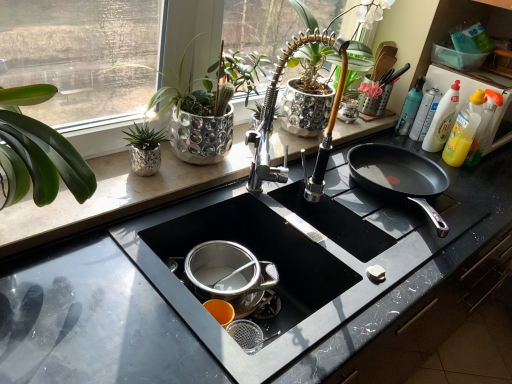
Where is `free point above black marble countertop at center (from a real-world perspective)`? The width and height of the screenshot is (512, 384). free point above black marble countertop at center (from a real-world perspective) is located at coordinates (386, 215).